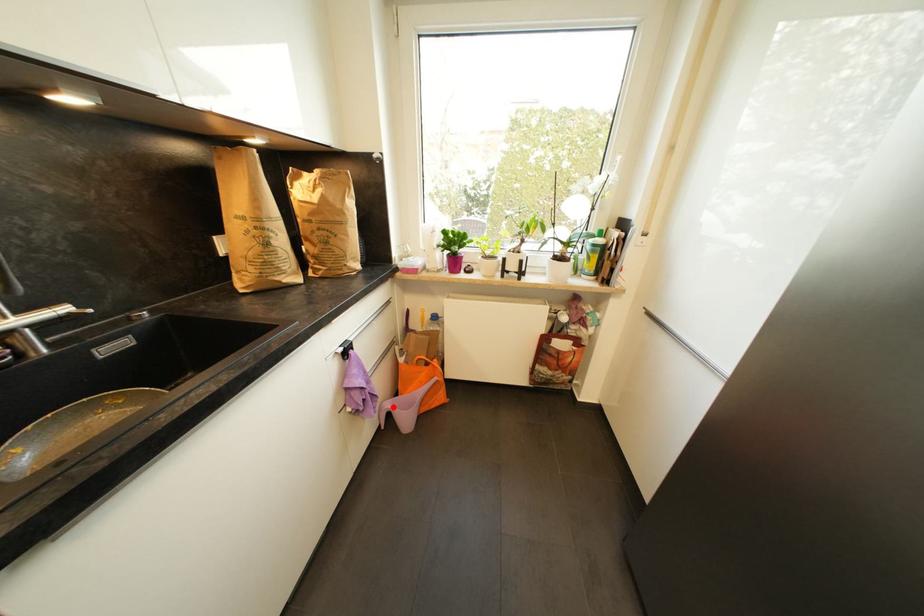
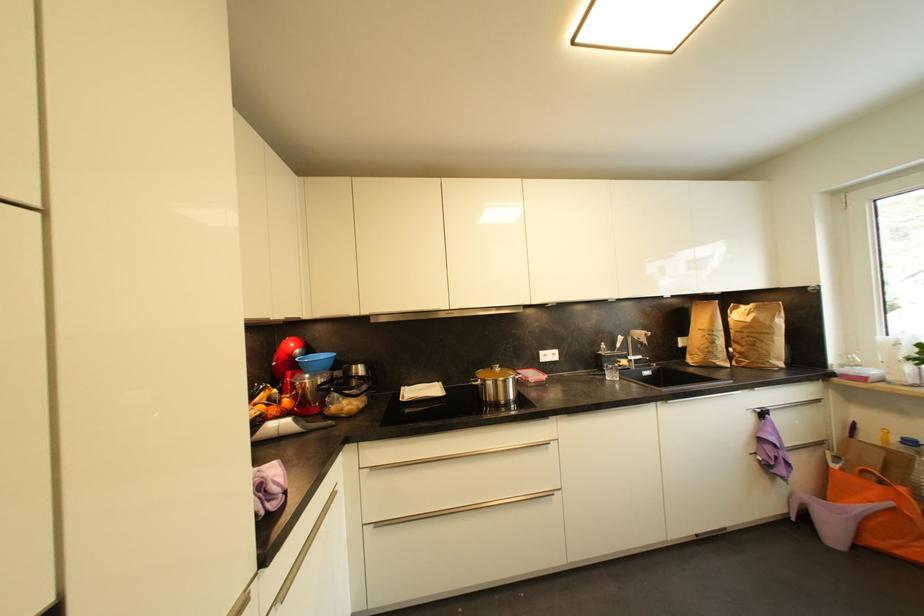
Question: A red point is marked in image1. In image2, is the corresponding 3D point closer to the camera or farther? Reply with the corresponding letter.

Choices:
 (A) The corresponding 3D point is closer.
 (B) The corresponding 3D point is farther.

Answer: (A)